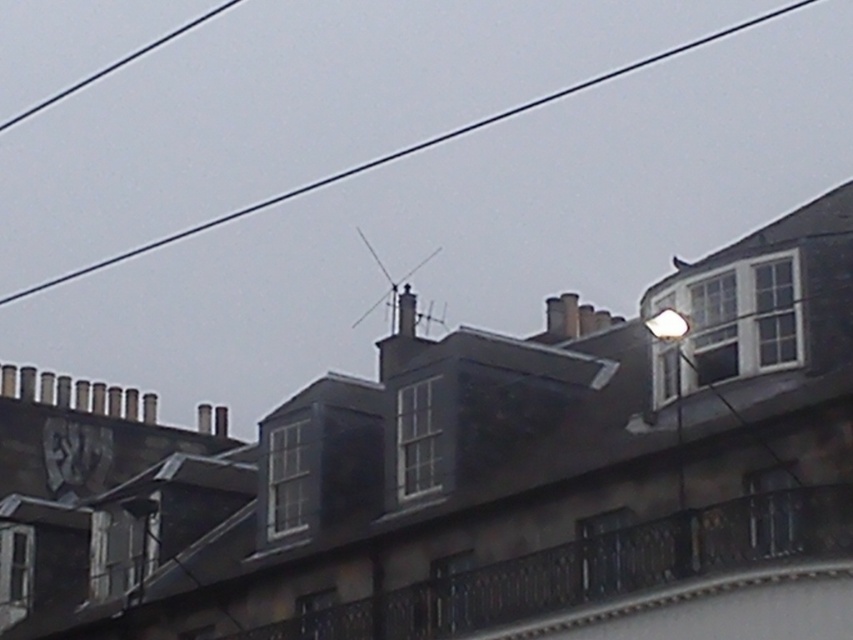
Question: Is metallic gray clock at upper left above smooth gray chimney at center?

Choices:
 (A) yes
 (B) no

Answer: (B)

Question: Which point appears farthest from the camera in this image?

Choices:
 (A) (409, 348)
 (B) (57, 442)

Answer: (B)

Question: Which point is closer to the camera?

Choices:
 (A) (392, 333)
 (B) (148, 243)
 (C) (44, 456)

Answer: (A)

Question: Is black wire at upper center to the left of metallic gray clock at upper left from the viewer's perspective?

Choices:
 (A) yes
 (B) no

Answer: (B)

Question: Is black wire at upper center to the right of metallic gray clock at upper left from the viewer's perspective?

Choices:
 (A) yes
 (B) no

Answer: (A)

Question: Which object appears farthest from the camera in this image?

Choices:
 (A) smooth gray chimney at center
 (B) metallic gray clock at upper left

Answer: (B)